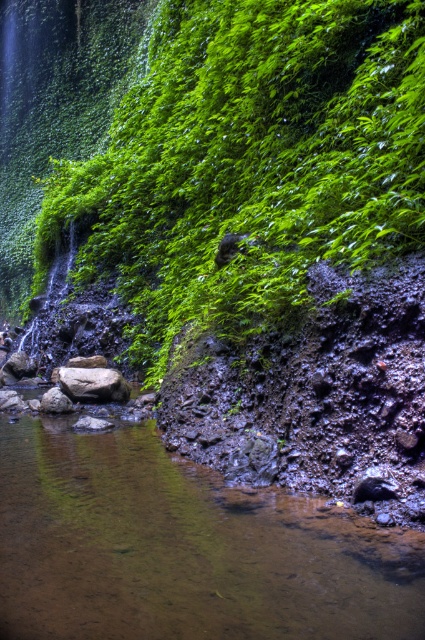
Can you confirm if brown rock at lower left is positioned to the right of brown rough rock at center?

Correct, you'll find brown rock at lower left to the right of brown rough rock at center.

Can you confirm if brown rock at lower left is taller than brown rough rock at center?

Incorrect, brown rock at lower left's height is not larger of brown rough rock at center's.

Which is in front, point (56, 534) or point (124, 385)?

Positioned in front is point (56, 534).

Locate an element on the screen. brown rock at lower left is located at coordinates (183, 548).

Can you confirm if green leafy vegetation at left is positioned to the right of brown rock at lower left?

In fact, green leafy vegetation at left is to the left of brown rock at lower left.

Locate an element on the screen. green leafy vegetation at left is located at coordinates (251, 161).

Can you confirm if green leafy vegetation at left is positioned to the left of brown rough rock at center?

In fact, green leafy vegetation at left is to the right of brown rough rock at center.

Does green leafy vegetation at left have a lesser width compared to brown rough rock at center?

In fact, green leafy vegetation at left might be wider than brown rough rock at center.

Which is behind, point (155, 355) or point (122, 394)?

The point (155, 355) is behind.

Locate an element on the screen. The width and height of the screenshot is (425, 640). green leafy vegetation at left is located at coordinates (251, 161).